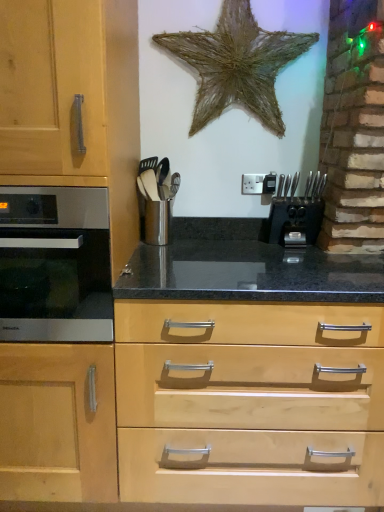
Question: Looking at the image, does metallic silver utensil holder at center seem bigger or smaller compared to satin silver oven at left?

Choices:
 (A) small
 (B) big

Answer: (A)

Question: Considering the positions of point (147, 167) and point (96, 336), is point (147, 167) closer or farther from the camera than point (96, 336)?

Choices:
 (A) farther
 (B) closer

Answer: (A)

Question: Based on their relative distances, which object is nearer to the metallic silver utensil holder at center?

Choices:
 (A) black plastic knife block at center right
 (B) satin silver oven at left
 (C) light wood drawer at center

Answer: (A)

Question: Based on their relative distances, which object is farther from the satin silver oven at left?

Choices:
 (A) black plastic knife block at center right
 (B) metallic silver utensil holder at center
 (C) light wood drawer at center

Answer: (A)